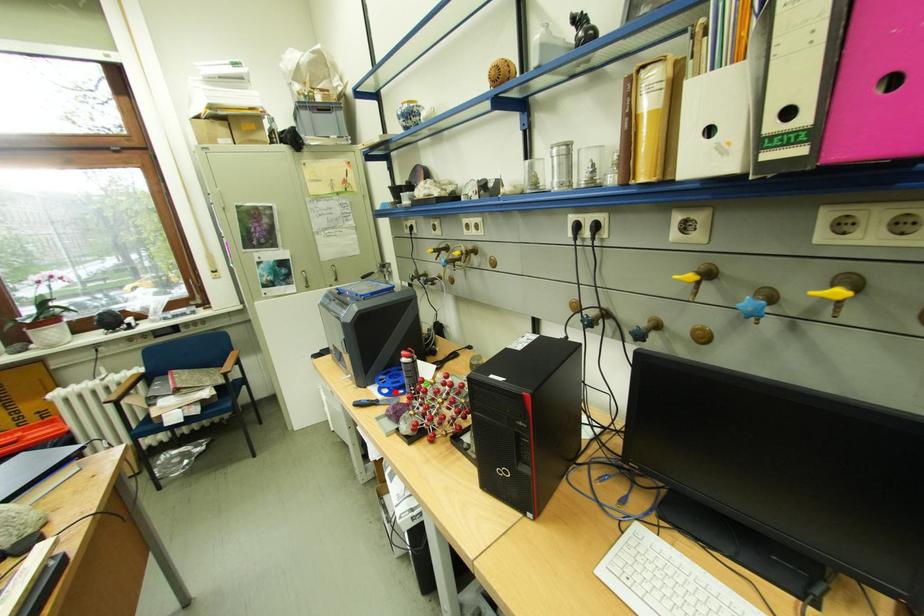
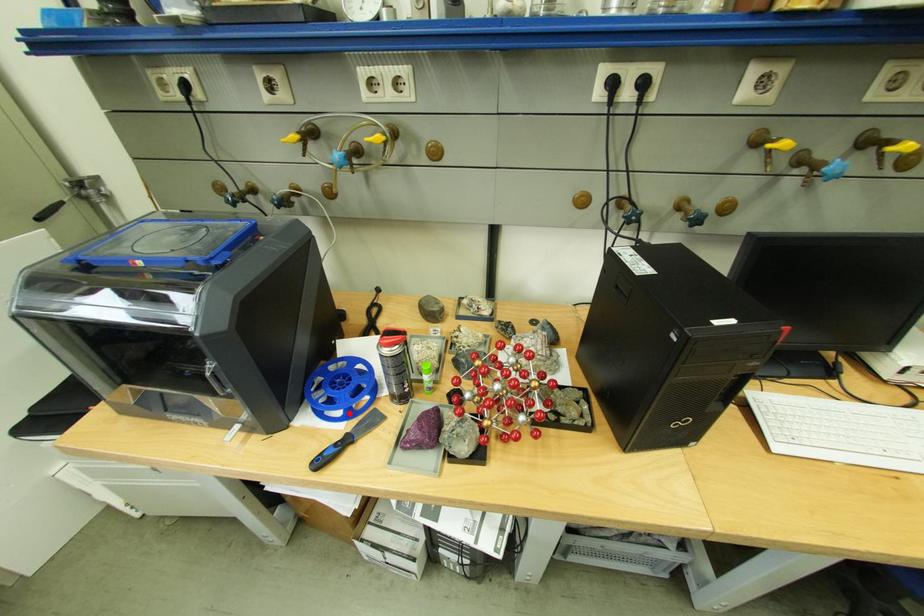
I am providing you with two images of the same scene from different viewpoints. A red point is marked on the first image and another point is marked on the second image. Do the highlighted points in image1 and image2 indicate the same real-world spot?

Yes